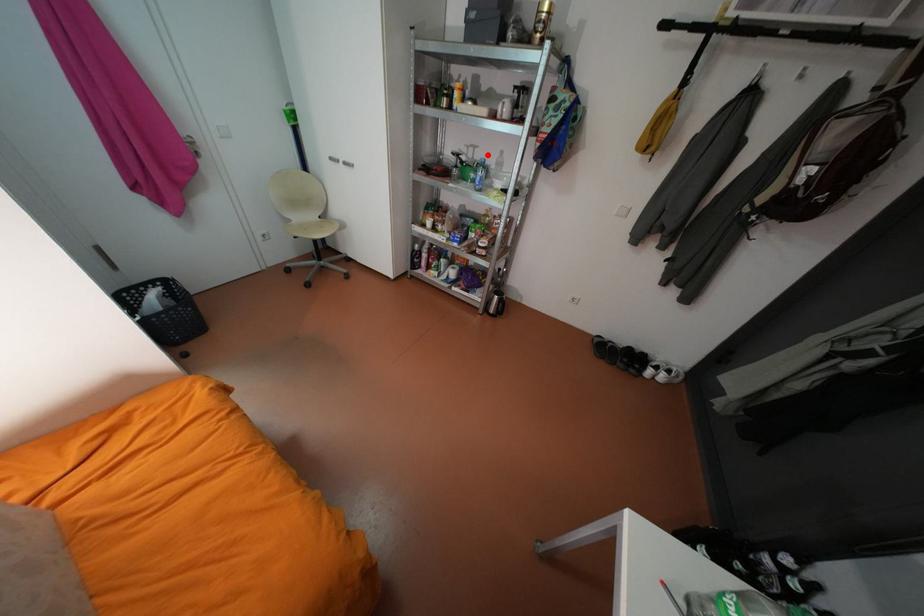
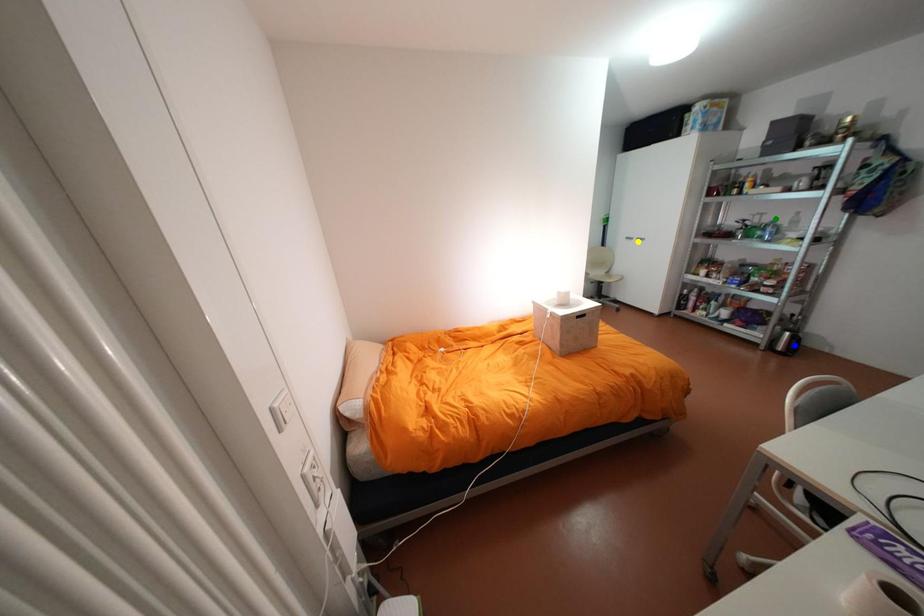
Question: I am providing you with two images of the same scene from different viewpoints. A red point is marked on the first image. You are given multiple points on the second image. In image 2, which mark is for the same physical point as the one in image 1?

Choices:
 (A) blue point
 (B) green point
 (C) yellow point

Answer: (B)